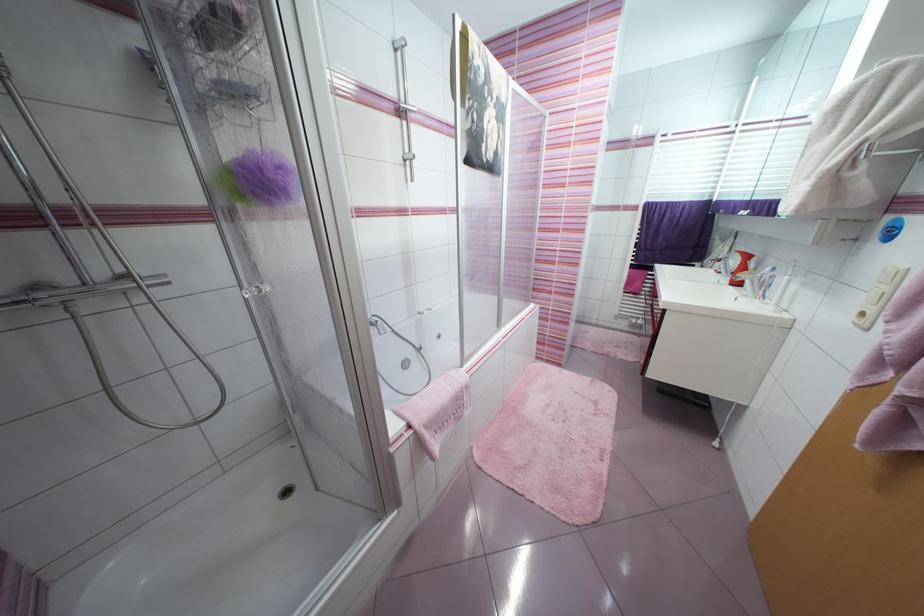
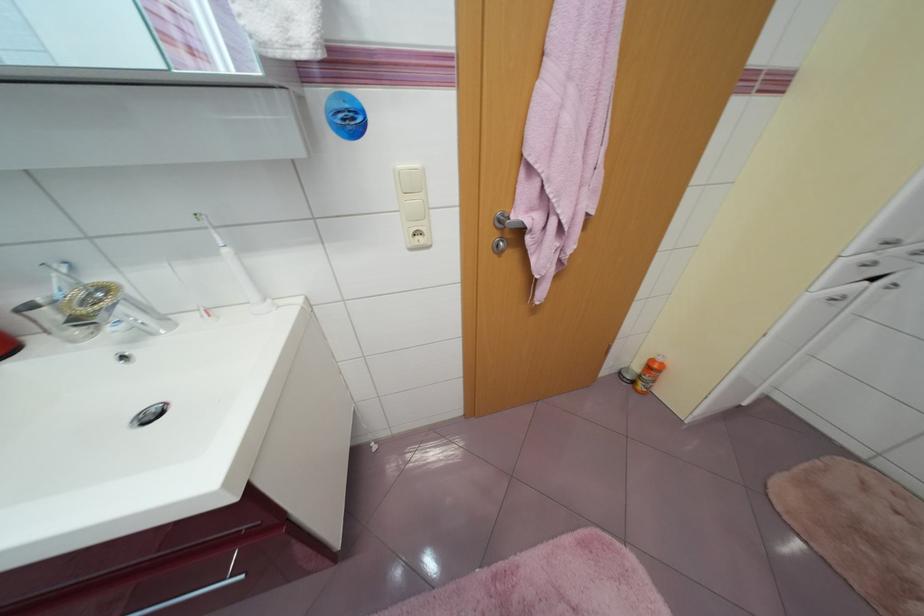
Find the pixel in the second image that matches (783,307) in the first image.

(270, 302)